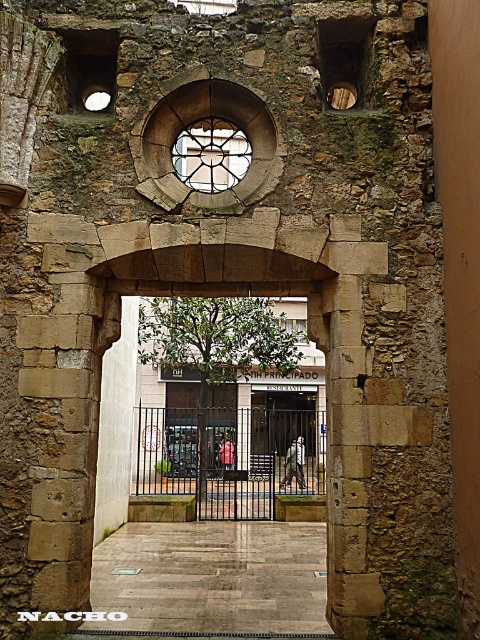
Question: Which of these objects is positioned farthest from the cracked stone archway at center?

Choices:
 (A) brown rough stone pillar at right
 (B) stained glass window at center
 (C) stone archway at center

Answer: (A)

Question: Does stone archway at center have a greater width compared to stained glass window at center?

Choices:
 (A) no
 (B) yes

Answer: (B)

Question: Is stone archway at center to the left of stained glass window at center from the viewer's perspective?

Choices:
 (A) no
 (B) yes

Answer: (B)

Question: Does stone archway at center lie behind brown rough stone pillar at right?

Choices:
 (A) yes
 (B) no

Answer: (A)

Question: Estimate the real-world distances between objects in this image. Which object is farther from the cracked stone archway at center?

Choices:
 (A) stained glass window at center
 (B) brown rough stone pillar at right
 (C) stone archway at center

Answer: (B)

Question: Which of the following is the farthest from the observer?

Choices:
 (A) cracked stone archway at center
 (B) stained glass window at center
 (C) stone archway at center
 (D) brown rough stone pillar at right

Answer: (B)